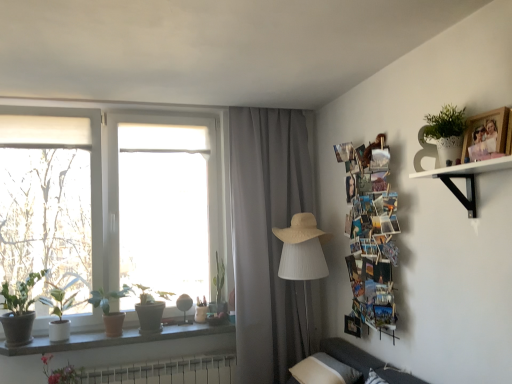
Question: From the image's perspective, is white matte shelf at upper right positioned above or below pink matte flower at lower left?

Choices:
 (A) above
 (B) below

Answer: (A)

Question: Considering the positions of point (435, 173) and point (73, 369), is point (435, 173) closer or farther from the camera than point (73, 369)?

Choices:
 (A) farther
 (B) closer

Answer: (B)

Question: Which object is the farthest from the green matte plant at window, arranged as the second houseplant when viewed from the right?

Choices:
 (A) green matte plant at window, the 3th houseplant viewed from the left
 (B) green matte plant at lower left, which ranks as the fifth houseplant in right-to-left order
 (C) green matte plant at left, positioned as the 2th houseplant in left-to-right order
 (D) pink matte flower at lower left
 (E) gray fabric curtain at center

Answer: (E)

Question: Which of these objects is positioned closest to the green matte plant at window, acting as the 4th houseplant starting from the left?

Choices:
 (A) gray fabric curtain at center
 (B) green matte plant at lower left, which ranks as the fifth houseplant in right-to-left order
 (C) wooden photo frame at upper right
 (D) green matte plant at left, positioned as the 2th houseplant in left-to-right order
 (E) white matte shelf at upper right

Answer: (D)